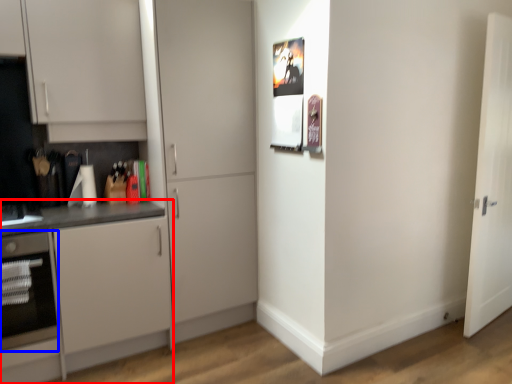
Question: Which point is further to the camera, cabinetry (highlighted by a red box) or oven (highlighted by a blue box)?

Choices:
 (A) cabinetry
 (B) oven

Answer: (B)